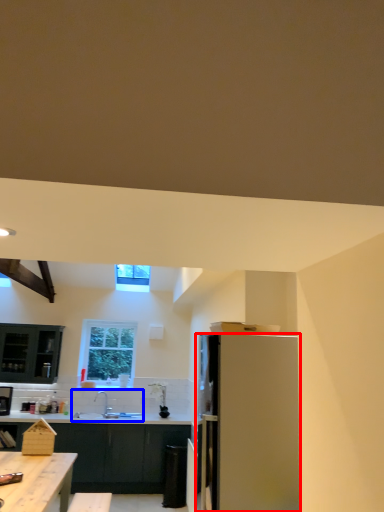
Question: Which point is closer to the camera, refrigerator (highlighted by a red box) or sink (highlighted by a blue box)?

Choices:
 (A) refrigerator
 (B) sink

Answer: (A)